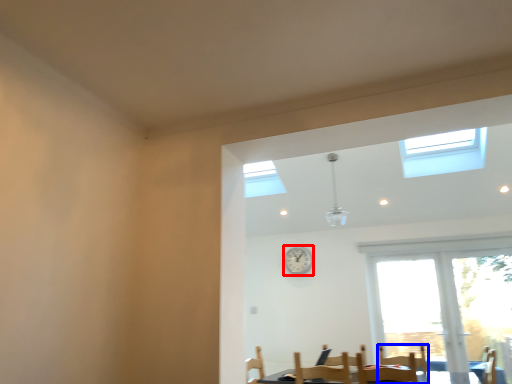
Question: Among these objects, which one is nearest to the camera, clock (highlighted by a red box) or armchair (highlighted by a blue box)?

Choices:
 (A) clock
 (B) armchair

Answer: (B)